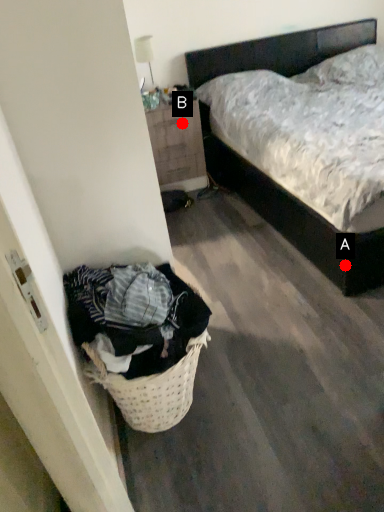
Question: Two points are circled on the image, labeled by A and B beside each circle. Which point is closer to the camera?

Choices:
 (A) A is closer
 (B) B is closer

Answer: (A)